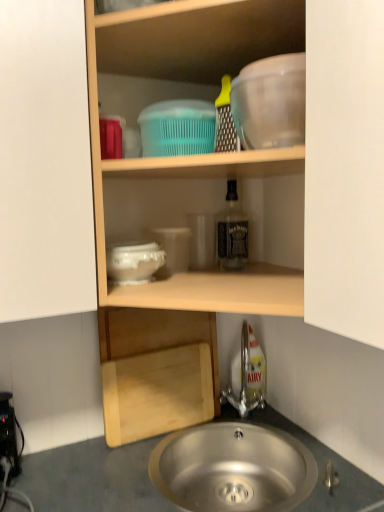
Question: Is transparent plastic mixing bowl at upper right situated inside black plastic power strip at lower left or outside?

Choices:
 (A) outside
 (B) inside

Answer: (A)

Question: Does point (261, 128) appear closer or farther from the camera than point (1, 414)?

Choices:
 (A) closer
 (B) farther

Answer: (A)

Question: Which object is positioned farthest from the white glossy bowl at center, the 1th basin from the bottom?

Choices:
 (A) black plastic power strip at lower left
 (B) stainless steel sink at lower center
 (C) translucent plastic shelf at upper center
 (D) smooth gray countertop at lower center
 (E) transparent plastic mixing bowl at upper right

Answer: (B)

Question: Which object is the farthest from the translucent plastic shelf at upper center?

Choices:
 (A) clear glass bottle at center
 (B) white glossy bowl at center, the 1th basin from the bottom
 (C) smooth gray countertop at lower center
 (D) teal plastic basin at upper center, the 2th basin when ordered from bottom to top
 (E) black plastic power strip at lower left

Answer: (E)